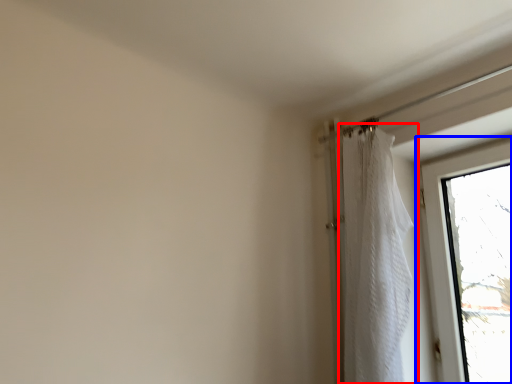
Question: Among these objects, which one is nearest to the camera, curtain (highlighted by a red box) or window (highlighted by a blue box)?

Choices:
 (A) curtain
 (B) window

Answer: (A)